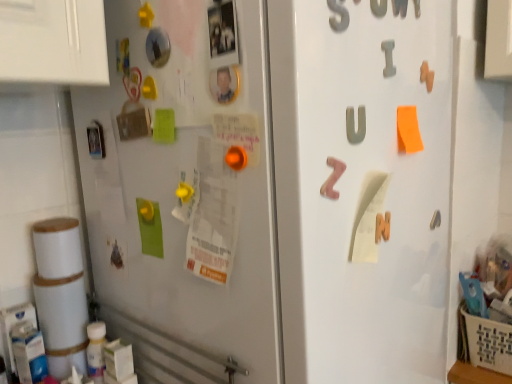
Question: Should I look upward or downward to see matte gray letter u at center, the 2th alphabet ordered from the bottom?

Choices:
 (A) down
 (B) up

Answer: (B)

Question: From a real-world perspective, is pink foam letter z at center, acting as the 1th alphabet starting from the left, on beige woven basket at lower right?

Choices:
 (A) no
 (B) yes

Answer: (B)

Question: Are pink foam letter z at center, which is the third alphabet in back-to-front order, and beige woven basket at lower right making contact?

Choices:
 (A) no
 (B) yes

Answer: (A)

Question: Does pink foam letter z at center, which is the first alphabet in front-to-back order, have a lesser width compared to beige woven basket at lower right?

Choices:
 (A) no
 (B) yes

Answer: (B)

Question: Is pink foam letter z at center, the first alphabet when ordered from bottom to top, further to the viewer compared to beige woven basket at lower right?

Choices:
 (A) yes
 (B) no

Answer: (B)

Question: Could you tell me if pink foam letter z at center, the third alphabet when ordered from top to bottom, is facing beige woven basket at lower right?

Choices:
 (A) yes
 (B) no

Answer: (B)

Question: Considering the relative sizes of pink foam letter z at center, the first alphabet when ordered from bottom to top, and beige woven basket at lower right in the image provided, is pink foam letter z at center, the first alphabet when ordered from bottom to top, wider than beige woven basket at lower right?

Choices:
 (A) no
 (B) yes

Answer: (A)

Question: Is pink foam letter z at center, the first alphabet when ordered from bottom to top, at the back of beige woven basket at lower right?

Choices:
 (A) yes
 (B) no

Answer: (B)

Question: Is beige woven basket at lower right shorter than pink foam letter z at center, which is the third alphabet in back-to-front order?

Choices:
 (A) yes
 (B) no

Answer: (B)

Question: Does beige woven basket at lower right come in front of pink foam letter z at center, the third alphabet when ordered from right to left?

Choices:
 (A) no
 (B) yes

Answer: (A)

Question: Considering the relative sizes of beige woven basket at lower right and pink foam letter z at center, acting as the 1th alphabet starting from the left, in the image provided, is beige woven basket at lower right bigger than pink foam letter z at center, acting as the 1th alphabet starting from the left,?

Choices:
 (A) yes
 (B) no

Answer: (A)

Question: Considering the relative sizes of beige woven basket at lower right and pink foam letter z at center, which is the third alphabet in back-to-front order, in the image provided, is beige woven basket at lower right thinner than pink foam letter z at center, which is the third alphabet in back-to-front order,?

Choices:
 (A) no
 (B) yes

Answer: (A)

Question: Would you consider beige woven basket at lower right to be distant from pink foam letter z at center, which is the third alphabet in back-to-front order?

Choices:
 (A) no
 (B) yes

Answer: (A)

Question: From the image's perspective, would you say metallic gray letter at upper center, the first number in the right-to-left sequence, is shown under pink foam letter z at center, which is the third alphabet in back-to-front order?

Choices:
 (A) yes
 (B) no

Answer: (B)